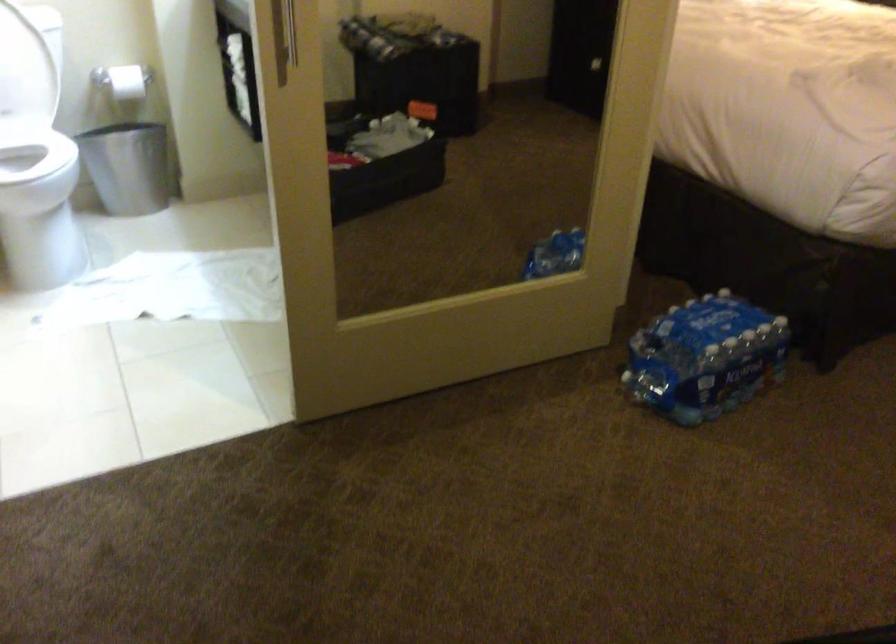
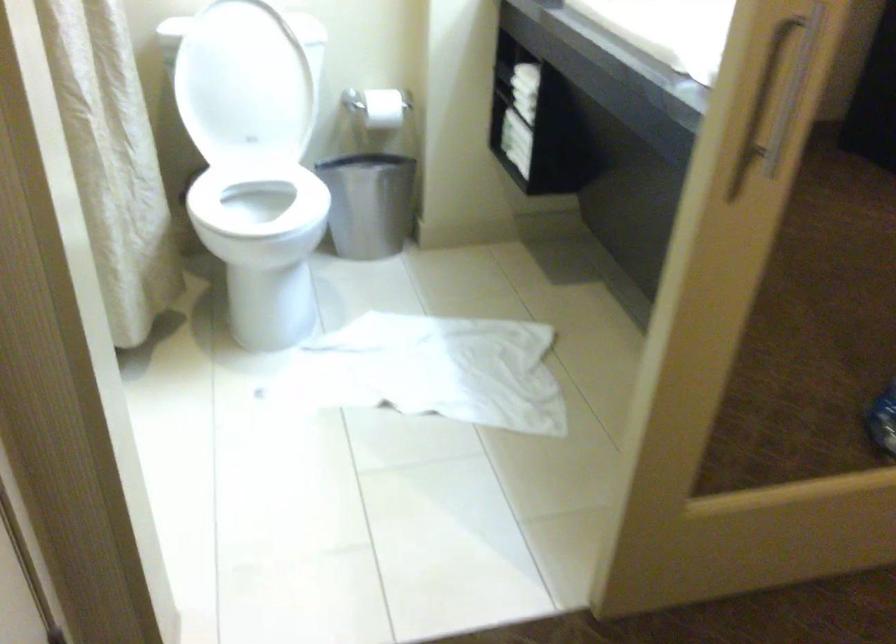
Where in the second image is the point corresponding to (126,160) from the first image?

(367, 204)